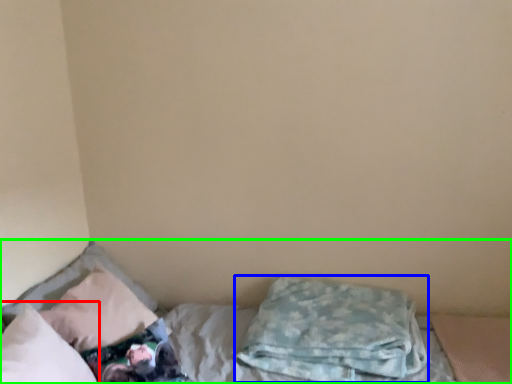
Question: Which object is the closest to the pillow (highlighted by a red box)? Choose among these: pillow (highlighted by a blue box) or bed (highlighted by a green box).

Choices:
 (A) pillow
 (B) bed

Answer: (B)